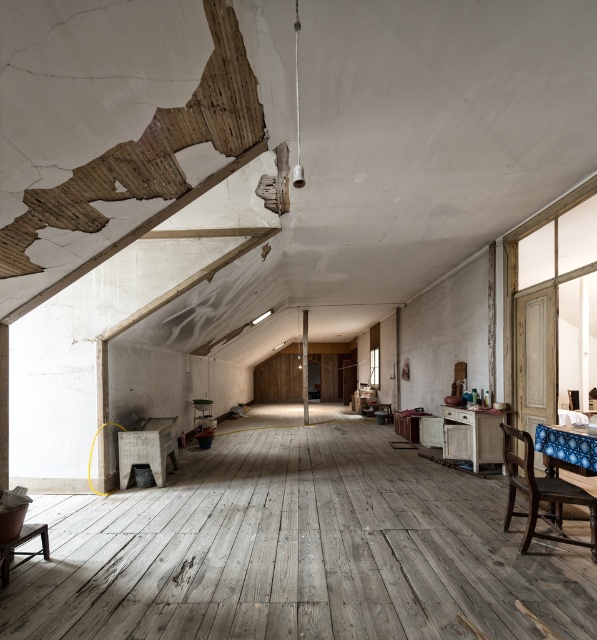
Consider the image. You are an interior designer planning to place a new sofa in this attic. The sofa is the same size as the wooden beam at center. Will the dark wood chair at lower right fit in the space where the sofa will be placed?

The dark wood chair at lower right has a larger size compared to the wooden beam at center. Since the sofa is the same size as the wooden beam at center, the dark wood chair at lower right would not fit in the space where the sofa will be placed because it is bigger.